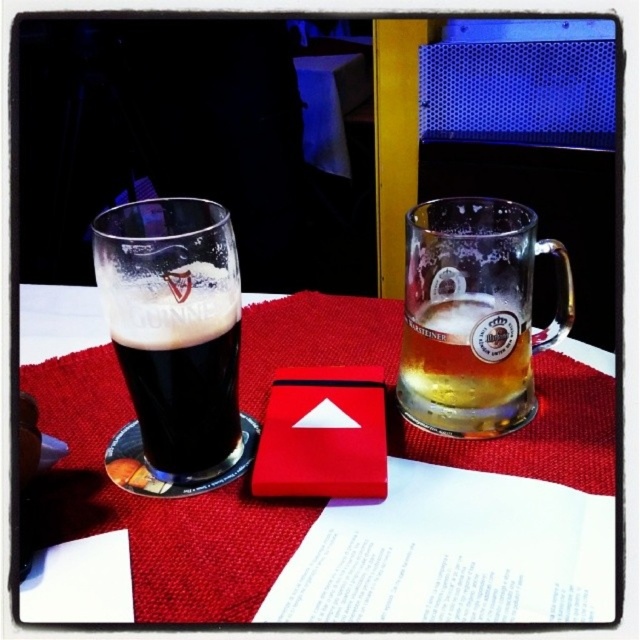
Is red fabric placemat at center to the right of dark glass at left from the viewer's perspective?

Correct, you'll find red fabric placemat at center to the right of dark glass at left.

Is point (451, 588) more distant than point (170, 381)?

No.

Which is behind, point (552, 536) or point (220, 378)?

The point (220, 378) is behind.

Where is `red fabric placemat at center`? The width and height of the screenshot is (640, 640). red fabric placemat at center is located at coordinates (321, 500).

Between dark glass at left and translucent glass mug at upper right, which one has less height?

Standing shorter between the two is translucent glass mug at upper right.

Where is `dark glass at left`? The width and height of the screenshot is (640, 640). dark glass at left is located at coordinates (173, 328).

Is red fabric placemat at center above translucent glass mug at upper right?

No.

Who is lower down, red fabric placemat at center or translucent glass mug at upper right?

Positioned lower is red fabric placemat at center.

Find the location of a particular element. red fabric placemat at center is located at coordinates (321, 500).